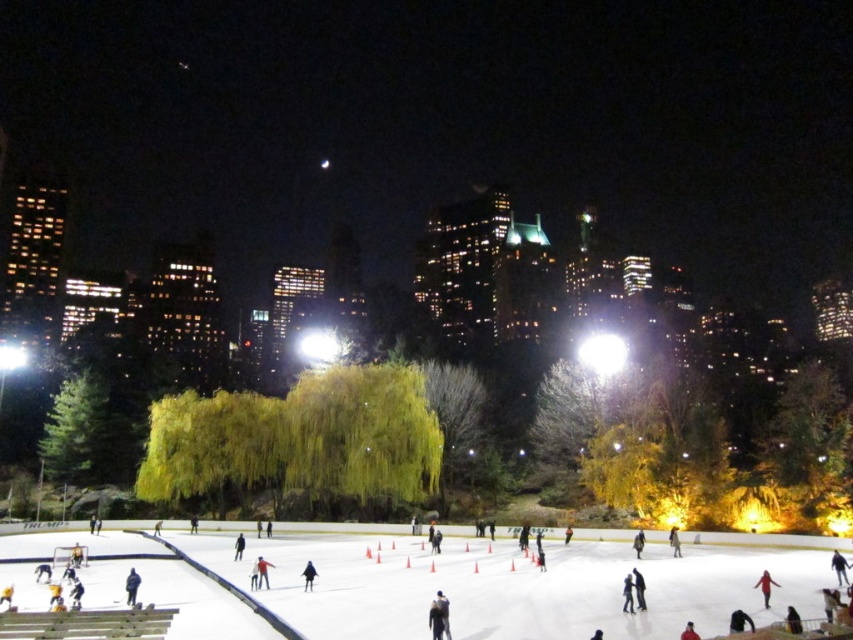
You are standing at the edge of the ice rink and see two people wearing the blue fabric jacket at center and the black matte jacket at center. Which jacket is located to the left when facing the rink?

The blue fabric jacket at center is positioned on the left side of the black matte jacket at center, so when facing the rink, the blue fabric jacket at center is to the left.